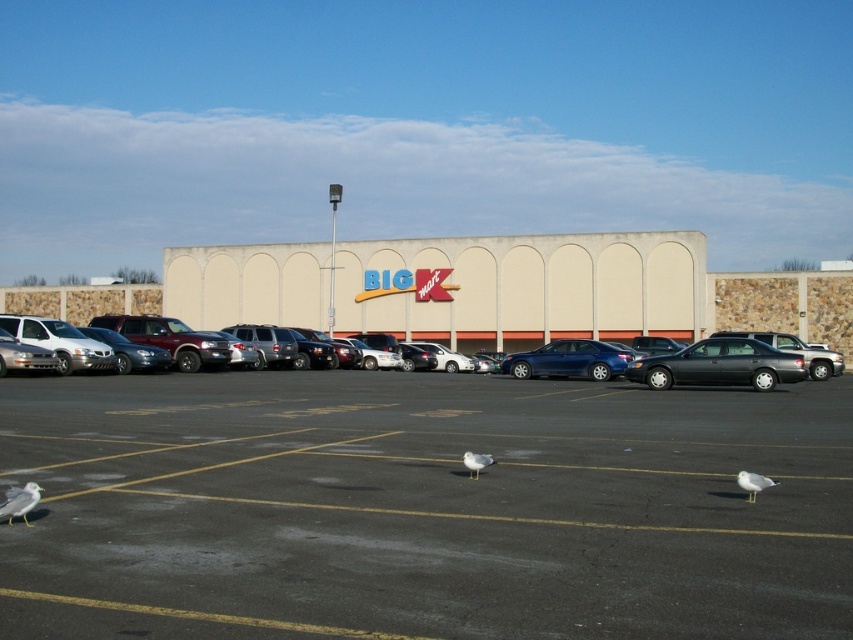
From the picture: You are standing at the entrance of the BIG Kmart store and notice two white feathered birds in the parking lot. Which one is wider between the white feathered bird at lower right and the white feathered bird at center?

The white feathered bird at lower right is wider than the white feathered bird at center.

You are a delivery driver who needs to park your truck in the parking lot. You see the shiny black sedan at center and the white feathered bird at center. Which object is wider, and how does this affect your parking space choice?

The shiny black sedan at center is wider than the white feathered bird at center. Since the sedan takes up more space, you should choose a parking spot that is wider than the sedan to accommodate your truck.